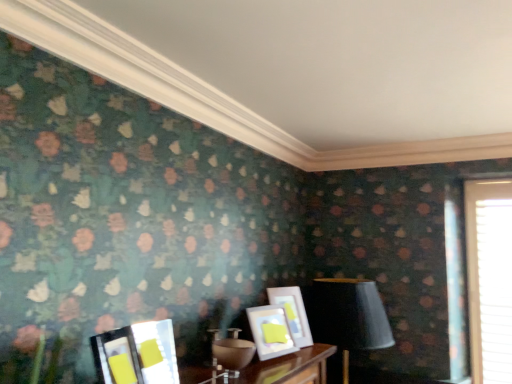
What do you see at coordinates (348, 316) in the screenshot? Image resolution: width=512 pixels, height=384 pixels. I see `matte black lampshade at center` at bounding box center [348, 316].

What do you see at coordinates (116, 357) in the screenshot? The width and height of the screenshot is (512, 384). I see `matte black picture frame at lower left, the 1th picture frame viewed from the front` at bounding box center [116, 357].

What do you see at coordinates (156, 351) in the screenshot?
I see `matte glass picture frame at lower left, the 3th picture frame in the back-to-front sequence` at bounding box center [156, 351].

The image size is (512, 384). What do you see at coordinates (489, 278) in the screenshot?
I see `white textured blinds at right` at bounding box center [489, 278].

Find the location of `matte white picture frame at center, which ranks as the second picture frame in back-to-front order`. matte white picture frame at center, which ranks as the second picture frame in back-to-front order is located at coordinates (271, 331).

Is matte black lampshade at center at the back of matte black picture frame at lower left, which is counted as the fourth picture frame, starting from the back?

No, matte black picture frame at lower left, which is counted as the fourth picture frame, starting from the back, is not facing away from matte black lampshade at center.

Considering the relative sizes of matte black picture frame at lower left, the 1th picture frame viewed from the front, and matte black lampshade at center in the image provided, is matte black picture frame at lower left, the 1th picture frame viewed from the front, shorter than matte black lampshade at center?

Correct, matte black picture frame at lower left, the 1th picture frame viewed from the front, is not as tall as matte black lampshade at center.

Is matte black lampshade at center completely or partially inside matte black picture frame at lower left, which is counted as the fourth picture frame, starting from the back?

No, matte black lampshade at center is not surrounded by matte black picture frame at lower left, which is counted as the fourth picture frame, starting from the back.

Is matte black picture frame at lower left, the 1th picture frame viewed from the front, further to the viewer compared to matte black lampshade at center?

No, matte black picture frame at lower left, the 1th picture frame viewed from the front, is closer to the viewer.

Is matte black lampshade at center turned away from matte white picture frame at center, the first picture frame when ordered from back to front?

No, matte black lampshade at center is not facing the opposite direction of matte white picture frame at center, the first picture frame when ordered from back to front.

Which object is closer to the camera, matte black lampshade at center or matte white picture frame at center, the first picture frame when ordered from back to front?

matte white picture frame at center, the first picture frame when ordered from back to front, is more forward.

Would you say matte black lampshade at center is outside matte white picture frame at center, which ranks as the fourth picture frame in front-to-back order?

Yes, matte black lampshade at center is outside of matte white picture frame at center, which ranks as the fourth picture frame in front-to-back order.

Which object is thinner, matte black lampshade at center or matte white picture frame at center, the first picture frame when ordered from back to front?

matte white picture frame at center, the first picture frame when ordered from back to front.

Locate an element on the screen. The image size is (512, 384). the 2nd picture frame to the right when counting from the matte glass picture frame at lower left, the 3th picture frame in the back-to-front sequence is located at coordinates (293, 312).

Is point (302, 308) closer to camera compared to point (157, 338)?

No, it is not.

From a real-world perspective, is matte white picture frame at center, the first picture frame when ordered from back to front, over matte glass picture frame at lower left, the 2th picture frame from the front?

Answer: Yes, from a real-world perspective, matte white picture frame at center, the first picture frame when ordered from back to front, is above matte glass picture frame at lower left, the 2th picture frame from the front.

Is matte white picture frame at center, the first picture frame when ordered from back to front, spatially inside matte glass picture frame at lower left, the 3th picture frame in the back-to-front sequence, or outside of it?

matte white picture frame at center, the first picture frame when ordered from back to front, cannot be found inside matte glass picture frame at lower left, the 3th picture frame in the back-to-front sequence.

Can you confirm if matte black lampshade at center is positioned to the right of matte glass picture frame at lower left, the 2th picture frame from the front?

Correct, you'll find matte black lampshade at center to the right of matte glass picture frame at lower left, the 2th picture frame from the front.

From their relative heights in the image, would you say matte black lampshade at center is taller or shorter than matte glass picture frame at lower left, the 3th picture frame in the back-to-front sequence?

Considering their sizes, matte black lampshade at center has more height than matte glass picture frame at lower left, the 3th picture frame in the back-to-front sequence.

How far apart are matte black lampshade at center and matte glass picture frame at lower left, the 3th picture frame in the back-to-front sequence?

A distance of 1.08 meters exists between matte black lampshade at center and matte glass picture frame at lower left, the 3th picture frame in the back-to-front sequence.

From a real-world perspective, is matte black lampshade at center under matte glass picture frame at lower left, the 2th picture frame from the front?

Yes, from a real-world perspective, matte black lampshade at center is beneath matte glass picture frame at lower left, the 2th picture frame from the front.

From a real-world perspective, which object rests below the other?

matte white picture frame at center, which ranks as the second picture frame in back-to-front order.

Between matte white picture frame at center, which ranks as the fourth picture frame in front-to-back order, and matte white picture frame at center, which ranks as the second picture frame in back-to-front order, which one is positioned behind?

matte white picture frame at center, which ranks as the fourth picture frame in front-to-back order, is behind.

Is point (298, 322) more distant than point (288, 350)?

Yes, point (298, 322) is behind point (288, 350).

Which object is positioned more to the left, matte white picture frame at center, which ranks as the fourth picture frame in front-to-back order, or matte white picture frame at center, positioned as the third picture frame in front-to-back order?

Positioned to the left is matte white picture frame at center, positioned as the third picture frame in front-to-back order.

Between matte black picture frame at lower left, which is counted as the fourth picture frame, starting from the back, and matte glass picture frame at lower left, the 3th picture frame in the back-to-front sequence, which one has smaller size?

matte black picture frame at lower left, which is counted as the fourth picture frame, starting from the back.

How many degrees apart are the facing directions of matte black picture frame at lower left, the 1th picture frame viewed from the front, and matte glass picture frame at lower left, the 2th picture frame from the front?

The angular difference between matte black picture frame at lower left, the 1th picture frame viewed from the front, and matte glass picture frame at lower left, the 2th picture frame from the front, is 8.85 degrees.

Considering the sizes of objects matte black picture frame at lower left, which is counted as the fourth picture frame, starting from the back, and matte glass picture frame at lower left, the 2th picture frame from the front, in the image provided, who is wider, matte black picture frame at lower left, which is counted as the fourth picture frame, starting from the back, or matte glass picture frame at lower left, the 2th picture frame from the front,?

With larger width is matte glass picture frame at lower left, the 2th picture frame from the front.

From a real-world perspective, between matte black picture frame at lower left, the 1th picture frame viewed from the front, and matte glass picture frame at lower left, the 3th picture frame in the back-to-front sequence, who is vertically higher?

matte glass picture frame at lower left, the 3th picture frame in the back-to-front sequence.

Consider the image. Can you confirm if matte glass picture frame at lower left, the 3th picture frame in the back-to-front sequence, is thinner than matte white picture frame at center, positioned as the third picture frame in front-to-back order?

Incorrect, the width of matte glass picture frame at lower left, the 3th picture frame in the back-to-front sequence, is not less than that of matte white picture frame at center, positioned as the third picture frame in front-to-back order.

Is matte glass picture frame at lower left, the 2th picture frame from the front, oriented away from matte white picture frame at center, which ranks as the second picture frame in back-to-front order?

No, matte glass picture frame at lower left, the 2th picture frame from the front,'s orientation is not away from matte white picture frame at center, which ranks as the second picture frame in back-to-front order.

Does point (152, 354) come closer to viewer compared to point (256, 317)?

Yes, it is in front of point (256, 317).

Locate an element on the screen. The height and width of the screenshot is (384, 512). the 4th picture frame counting from the left of the matte black lampshade at center is located at coordinates (116, 357).

The width and height of the screenshot is (512, 384). Find the location of `the 1st picture frame in front of the matte black lampshade at center, starting your count from the anchor`. the 1st picture frame in front of the matte black lampshade at center, starting your count from the anchor is located at coordinates (293, 312).

Estimate the real-world distances between objects in this image. Which object is further from matte glass picture frame at lower left, the 2th picture frame from the front, matte black lampshade at center or matte white picture frame at center, positioned as the third picture frame in front-to-back order?

matte black lampshade at center is further to matte glass picture frame at lower left, the 2th picture frame from the front.

Which object lies nearer to the anchor point matte white picture frame at center, which ranks as the fourth picture frame in front-to-back order, matte white picture frame at center, which ranks as the second picture frame in back-to-front order, or matte black picture frame at lower left, the 1th picture frame viewed from the front?

matte white picture frame at center, which ranks as the second picture frame in back-to-front order, is positioned closer to the anchor matte white picture frame at center, which ranks as the fourth picture frame in front-to-back order.

From the image, which object appears to be farther from matte black picture frame at lower left, which is counted as the fourth picture frame, starting from the back, matte black lampshade at center or matte white picture frame at center, which ranks as the fourth picture frame in front-to-back order?

matte black lampshade at center lies further to matte black picture frame at lower left, which is counted as the fourth picture frame, starting from the back, than the other object.

Looking at the image, which one is located further to matte white picture frame at center, positioned as the third picture frame in front-to-back order, matte black lampshade at center or white textured blinds at right?

white textured blinds at right is further to matte white picture frame at center, positioned as the third picture frame in front-to-back order.

Estimate the real-world distances between objects in this image. Which object is further from matte white picture frame at center, positioned as the third picture frame in front-to-back order, matte white picture frame at center, the first picture frame when ordered from back to front, or matte black lampshade at center?

matte black lampshade at center is positioned further to the anchor matte white picture frame at center, positioned as the third picture frame in front-to-back order.

Based on the photo, when comparing their distances from matte black lampshade at center, does matte black picture frame at lower left, which is counted as the fourth picture frame, starting from the back, or white textured blinds at right seem closer?

white textured blinds at right is positioned closer to the anchor matte black lampshade at center.

Based on their spatial positions, is matte white picture frame at center, the first picture frame when ordered from back to front, or matte glass picture frame at lower left, the 3th picture frame in the back-to-front sequence, closer to matte black picture frame at lower left, which is counted as the fourth picture frame, starting from the back?

The object closer to matte black picture frame at lower left, which is counted as the fourth picture frame, starting from the back, is matte glass picture frame at lower left, the 3th picture frame in the back-to-front sequence.

Looking at the image, which one is located further to matte black lampshade at center, matte white picture frame at center, which ranks as the fourth picture frame in front-to-back order, or matte black picture frame at lower left, the 1th picture frame viewed from the front?

matte black picture frame at lower left, the 1th picture frame viewed from the front, lies further to matte black lampshade at center than the other object.

Identify the location of table lamp located between matte white picture frame at center, which ranks as the second picture frame in back-to-front order, and white textured blinds at right in the left-right direction. (348, 316).

The height and width of the screenshot is (384, 512). Find the location of `table lamp between matte black picture frame at lower left, the 1th picture frame viewed from the front, and white textured blinds at right, in the horizontal direction`. table lamp between matte black picture frame at lower left, the 1th picture frame viewed from the front, and white textured blinds at right, in the horizontal direction is located at coordinates (348, 316).

Identify the location of picture frame between matte black picture frame at lower left, the 1th picture frame viewed from the front, and matte white picture frame at center, which ranks as the second picture frame in back-to-front order, in the front-back direction. This screenshot has height=384, width=512. (156, 351).

Where is `picture frame situated between matte white picture frame at center, positioned as the third picture frame in front-to-back order, and white textured blinds at right from left to right`? This screenshot has width=512, height=384. picture frame situated between matte white picture frame at center, positioned as the third picture frame in front-to-back order, and white textured blinds at right from left to right is located at coordinates (293, 312).